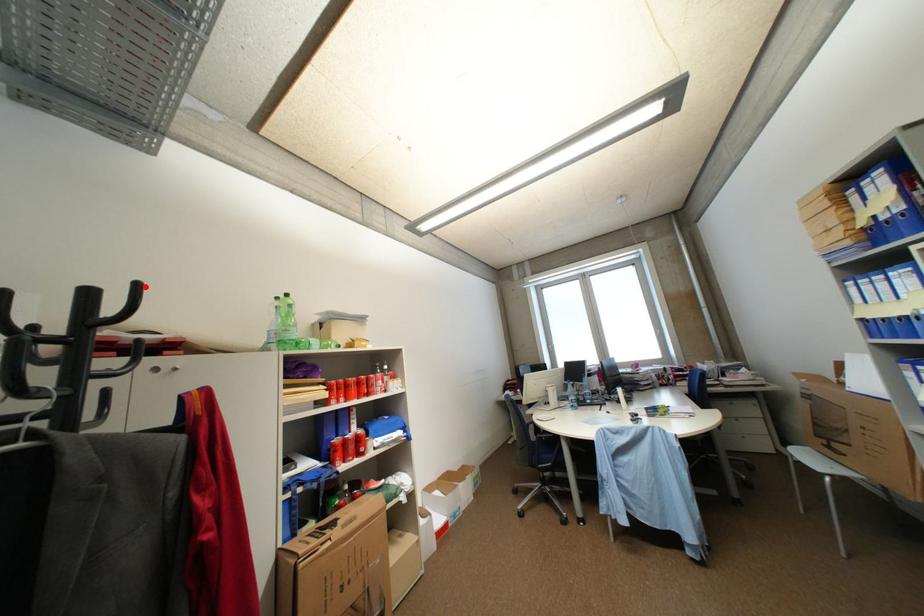
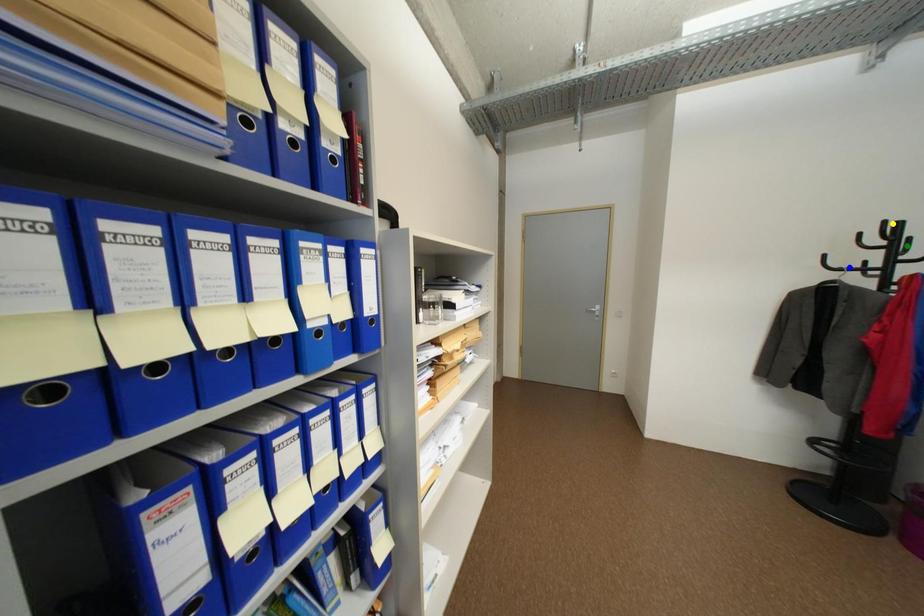
Question: I am providing you with two images of the same scene from different viewpoints. A red point is marked on the first image. You are given multiple points on the second image. In image 2, which mark is for the same physical point as the one in image 1?

Choices:
 (A) green point
 (B) blue point
 (C) yellow point

Answer: (C)